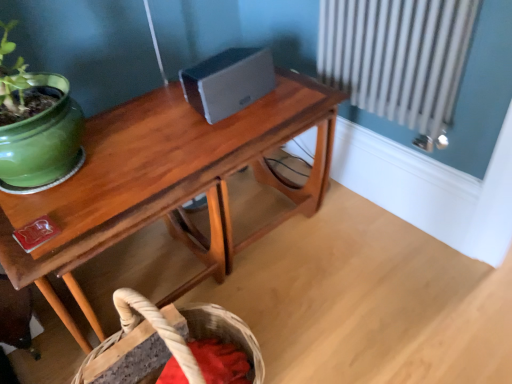
Question: From a real-world perspective, relative to wooden table at center, is woven natural fiber basket at lower center vertically above or below?

Choices:
 (A) below
 (B) above

Answer: (A)

Question: Would you say woven natural fiber basket at lower center is inside or outside wooden table at center?

Choices:
 (A) outside
 (B) inside

Answer: (A)

Question: Does point (166, 317) appear closer or farther from the camera than point (12, 213)?

Choices:
 (A) closer
 (B) farther

Answer: (B)

Question: Is wooden table at center taller or shorter than woven natural fiber basket at lower center?

Choices:
 (A) tall
 (B) short

Answer: (A)

Question: Relative to woven natural fiber basket at lower center, is wooden table at center in front or behind?

Choices:
 (A) front
 (B) behind

Answer: (A)

Question: From a real-world perspective, is wooden table at center positioned above or below woven natural fiber basket at lower center?

Choices:
 (A) above
 (B) below

Answer: (A)

Question: From the image's perspective, is wooden table at center positioned above or below woven natural fiber basket at lower center?

Choices:
 (A) above
 (B) below

Answer: (A)